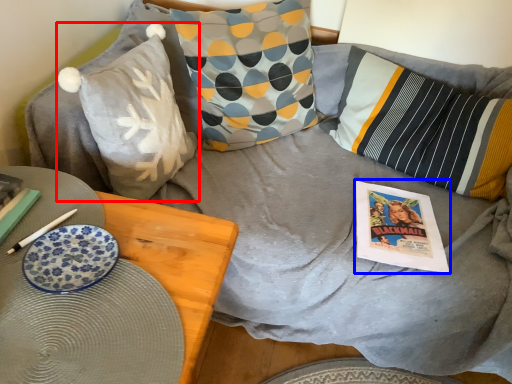
Question: Which object is further to the camera taking this photo, pillow (highlighted by a red box) or comic book (highlighted by a blue box)?

Choices:
 (A) pillow
 (B) comic book

Answer: (B)